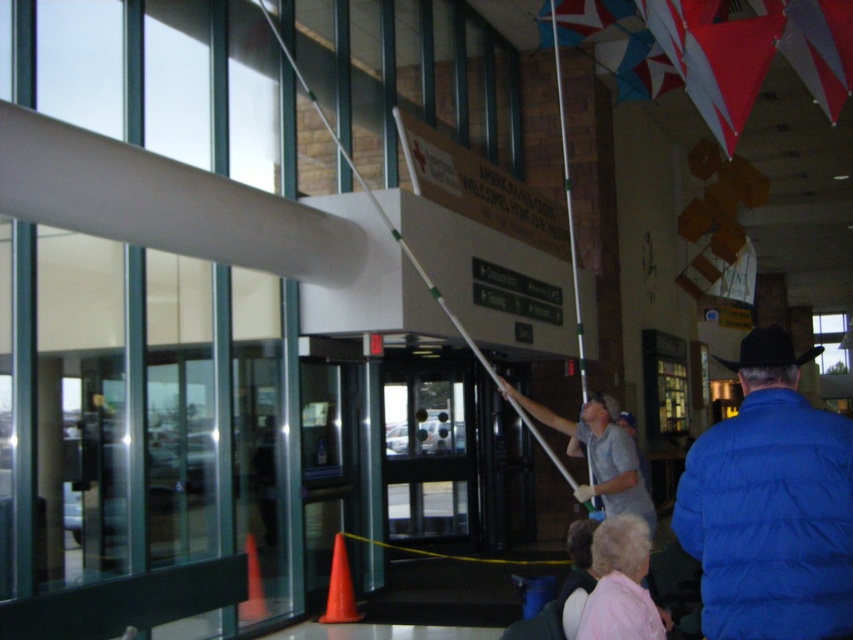
Can you confirm if blue puffy jacket at center is thinner than pink fabric at lower right?

No.

Does blue puffy jacket at center lie behind pink fabric at lower right?

No.

You are a GUI agent. You are given a task and a screenshot of the screen. Output one action in this format:
    pyautogui.click(x=<x>, y=<y>)
    Task: Click on the blue puffy jacket at center
    The height and width of the screenshot is (640, 853).
    Given the screenshot: What is the action you would take?
    pyautogui.click(x=770, y=506)

Is point (647, 632) positioned before point (386, 541)?

Yes, it is.

Does pink fabric at lower right have a greater width compared to yellow string at center?

Incorrect, pink fabric at lower right's width does not surpass yellow string at center's.

The height and width of the screenshot is (640, 853). What are the coordinates of `pink fabric at lower right` in the screenshot? It's located at (621, 584).

Based on the photo, is gray fabric pole at center shorter than orange matte cone at lower left?

Incorrect, gray fabric pole at center's height does not fall short of orange matte cone at lower left's.

Which is above, gray fabric pole at center or orange matte cone at lower left?

gray fabric pole at center

Does point (621, 458) come farther from viewer compared to point (335, 561)?

That is False.

At what (x,y) coordinates should I click in order to perform the action: click on gray fabric pole at center. Please return your answer as a coordinate pair (x, y). Looking at the image, I should click on (601, 454).